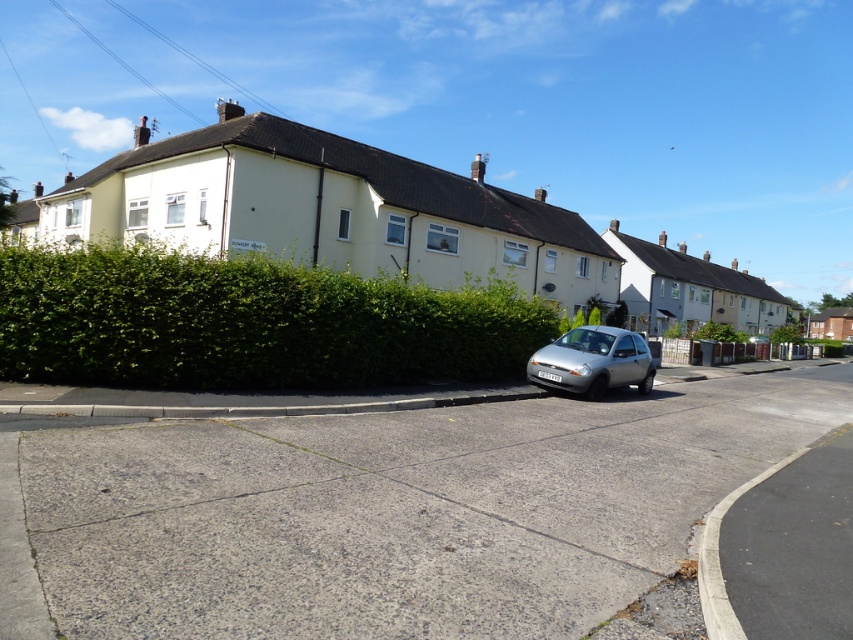
You are a delivery person trying to park your van next to the silver metallic hatchback at center. The van is 2 meters tall. Can you park there without hitting the green leafy hedge at center?

The green leafy hedge at center is much taller than the silver metallic hatchback at center, so the hedge is over 2 meters tall. Therefore, parking the van there might risk hitting the hedge.

Consider the image. You are standing on the residential street and want to determine which of the two points, point (200, 307) or point (635, 336), is closer to you. Based on the scene, which point is nearer?

Point (200, 307) is closer to the viewer than point (635, 336).